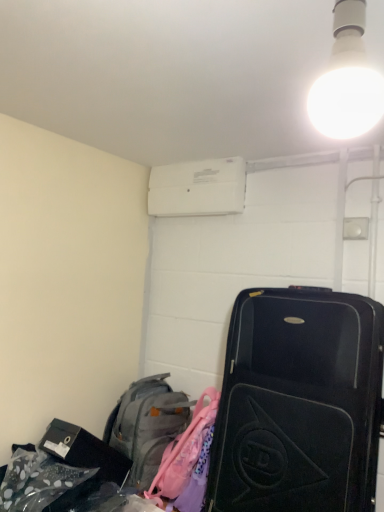
Question: From the image's perspective, is white plastic air conditioner at upper center on top of white glossy bulb at upper right?

Choices:
 (A) no
 (B) yes

Answer: (A)

Question: From a real-world perspective, is white plastic air conditioner at upper center physically below white glossy bulb at upper right?

Choices:
 (A) yes
 (B) no

Answer: (B)

Question: Is white plastic air conditioner at upper center thinner than white glossy bulb at upper right?

Choices:
 (A) yes
 (B) no

Answer: (A)

Question: Can white glossy bulb at upper right be found inside white plastic air conditioner at upper center?

Choices:
 (A) no
 (B) yes

Answer: (A)

Question: From the image's perspective, does white plastic air conditioner at upper center appear lower than white glossy bulb at upper right?

Choices:
 (A) no
 (B) yes

Answer: (B)

Question: Does white plastic air conditioner at upper center turn towards white glossy bulb at upper right?

Choices:
 (A) no
 (B) yes

Answer: (A)

Question: Is white plastic air conditioner at upper center aimed at black hardshell suitcase at right?

Choices:
 (A) no
 (B) yes

Answer: (A)

Question: From a real-world perspective, is white plastic air conditioner at upper center on black hardshell suitcase at right?

Choices:
 (A) no
 (B) yes

Answer: (B)

Question: Is white plastic air conditioner at upper center surrounding black hardshell suitcase at right?

Choices:
 (A) no
 (B) yes

Answer: (A)

Question: From a real-world perspective, is white plastic air conditioner at upper center physically below black hardshell suitcase at right?

Choices:
 (A) no
 (B) yes

Answer: (A)

Question: Is white plastic air conditioner at upper center next to black hardshell suitcase at right and touching it?

Choices:
 (A) no
 (B) yes

Answer: (A)

Question: Is white plastic air conditioner at upper center closer to camera compared to black hardshell suitcase at right?

Choices:
 (A) no
 (B) yes

Answer: (A)

Question: Does white glossy bulb at upper right have a greater width compared to black hardshell suitcase at right?

Choices:
 (A) yes
 (B) no

Answer: (B)